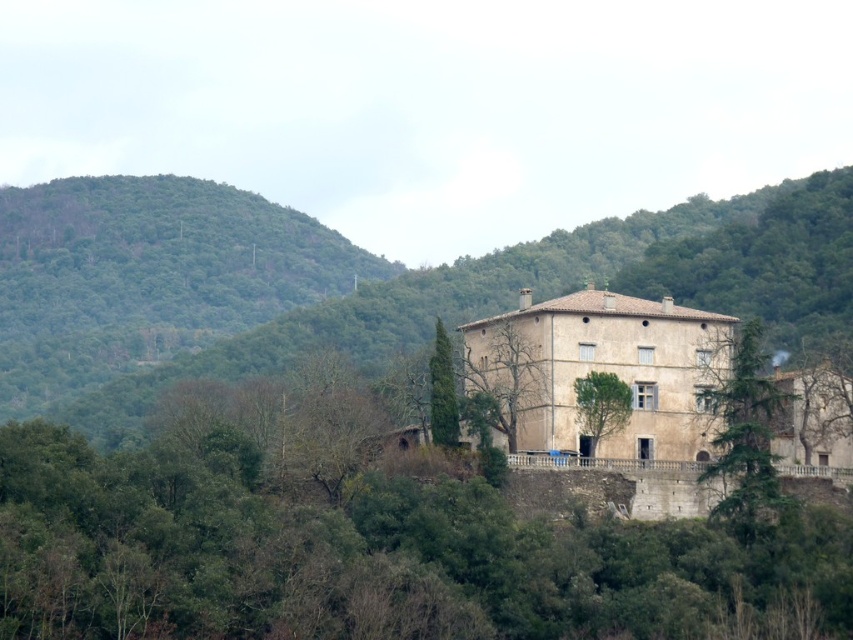
Looking at this image, you are a gardener standing at the edge of the property near the green leafy tree at center. You need to water the beige stone castle at center using a hose that can reach 10 meters. Will the hose be long enough to reach the castle from your current position?

The distance between the beige stone castle at center and the green leafy tree at center is 10.93 meters. Since the hose can only reach 10 meters, it is not long enough to water the beige stone castle at center from the current position.

Consider the image. You are standing at the camera position and want to walk to point (674, 355). Is the distance more than 400 feet?

Yes, the distance between the camera and point (674, 355) is 428.28 feet, which is more than 400 feet.

You are a landscape architect planning to add a new garden feature between the beige stone castle at center and the green leafy tree at center. Considering their sizes, which object should the garden feature be closer to to maintain visual balance?

The beige stone castle at center is larger in size than the green leafy tree at center, so the garden feature should be closer to the green leafy tree at center to balance their visual weights.